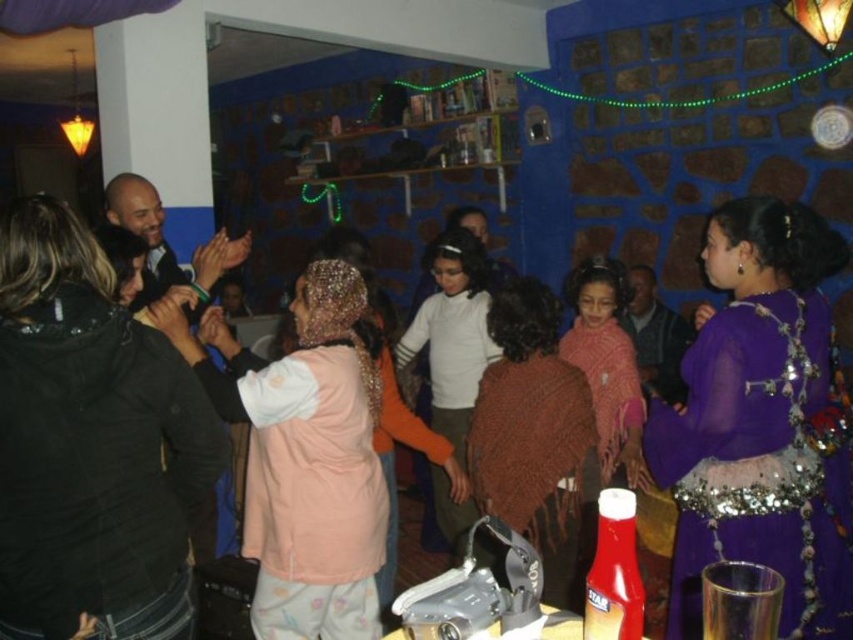
Question: Is pale pink fleece at center to the left of knitted brown shawl at center from the viewer's perspective?

Choices:
 (A) yes
 (B) no

Answer: (A)

Question: Can you confirm if black leather jacket at left is bigger than pale pink fleece at center?

Choices:
 (A) no
 (B) yes

Answer: (A)

Question: Which object is positioned farthest from the black leather jacket at left?

Choices:
 (A) white matte sweater at center
 (B) purple sequined dress at center
 (C) pale pink fleece at center
 (D) knitted brown shawl at center

Answer: (A)

Question: Which point is closer to the camera?

Choices:
 (A) (448, 337)
 (B) (746, 384)

Answer: (B)

Question: Does purple sequined dress at center appear under knitted brown shawl at center?

Choices:
 (A) yes
 (B) no

Answer: (B)

Question: Which of these objects is positioned farthest from the pale pink fleece at center?

Choices:
 (A) purple sequined dress at center
 (B) white matte sweater at center

Answer: (A)